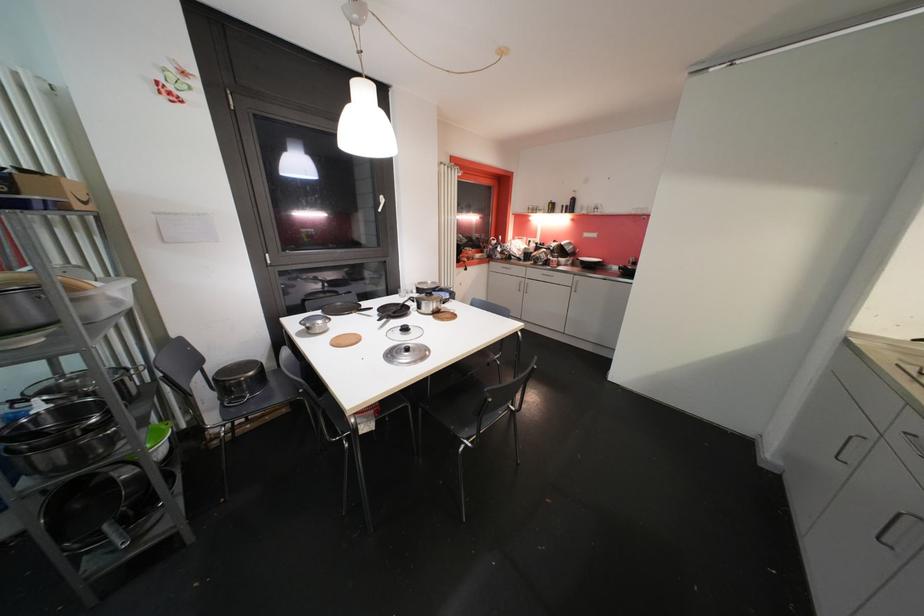
What do you see at coordinates (381, 203) in the screenshot? I see `a white window handle` at bounding box center [381, 203].